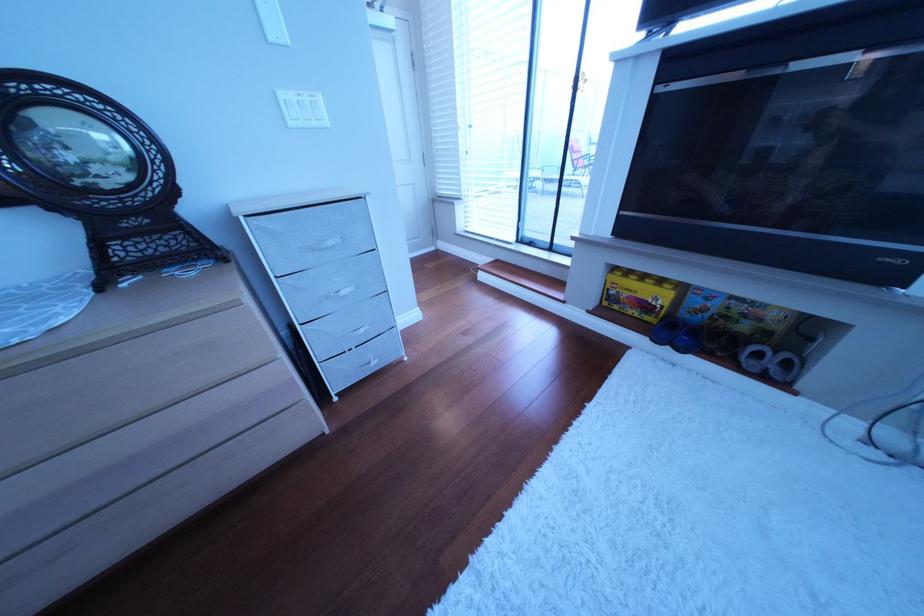
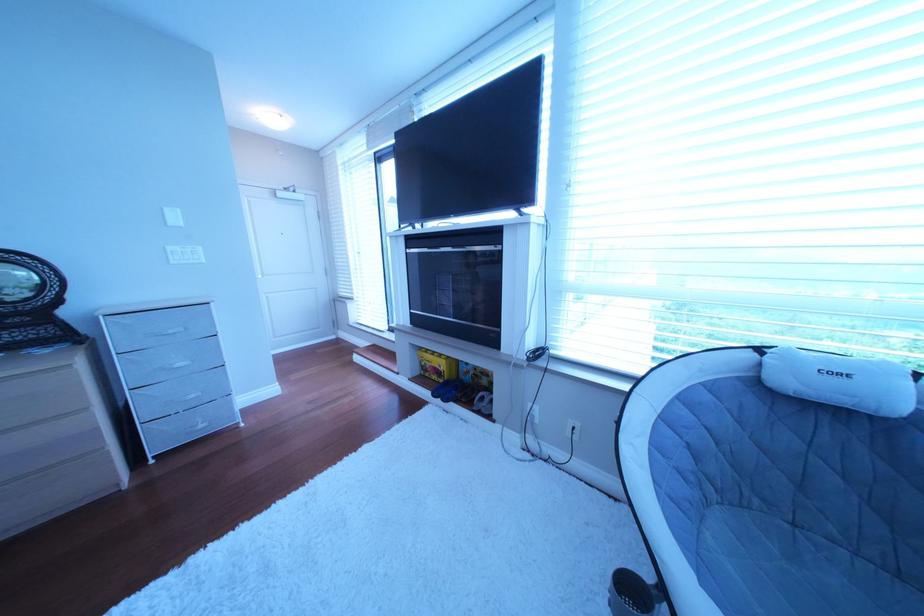
Which direction would the cameraman need to move to produce the second image?

The cameraman walked toward right, backward.